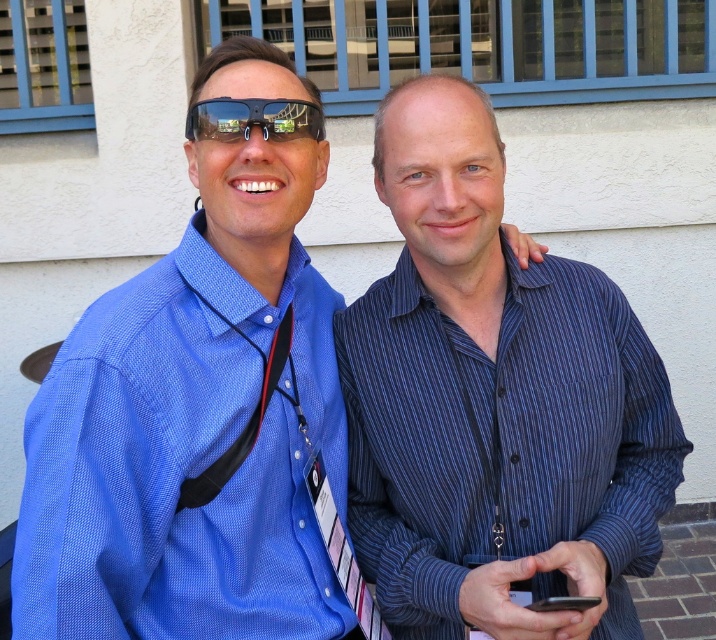
Is blue striped shirt at center wider than matte black sunglasses at center?

Yes, blue striped shirt at center is wider than matte black sunglasses at center.

Does blue striped shirt at center have a greater height compared to matte black sunglasses at center?

Correct, blue striped shirt at center is much taller as matte black sunglasses at center.

Who is more forward, [485,570] or [243,104]?

Positioned in front is point [243,104].

The height and width of the screenshot is (640, 716). In order to click on blue striped shirt at center in this screenshot , I will do `click(493, 401)`.

Can you confirm if blue striped shirt at center is smaller than black matte smartphone at lower center?

No, blue striped shirt at center is not smaller than black matte smartphone at lower center.

Does blue striped shirt at center appear under black matte smartphone at lower center?

Incorrect, blue striped shirt at center is not positioned below black matte smartphone at lower center.

Between point (483, 538) and point (581, 596), which one is positioned behind?

Positioned behind is point (483, 538).

The image size is (716, 640). Identify the location of blue striped shirt at center. (493, 401).

Between matte blue dress shirt at left and black matte smartphone at lower center, which one is positioned lower?

black matte smartphone at lower center is below.

Between matte blue dress shirt at left and black matte smartphone at lower center, which one appears on the right side from the viewer's perspective?

black matte smartphone at lower center is more to the right.

The width and height of the screenshot is (716, 640). What are the coordinates of `matte blue dress shirt at left` in the screenshot? It's located at (188, 464).